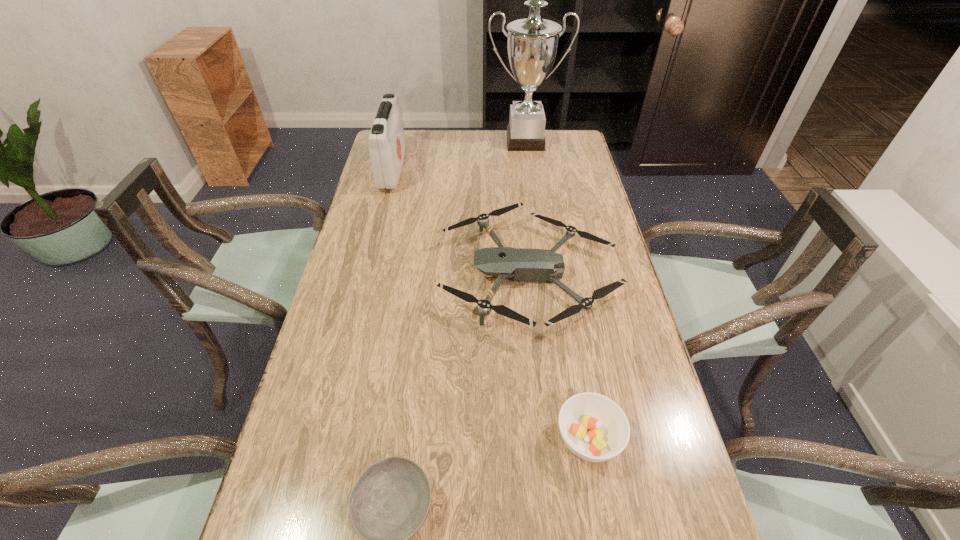
Identify the location of vacant point located 0.190m on the back of the soup bowl. This screenshot has height=540, width=960. (570, 339).

Identify the location of trophy cup that is positioned at the far edge. (532, 45).

The height and width of the screenshot is (540, 960). What are the coordinates of `the first-aid kit present at the far edge` in the screenshot? It's located at point(387,147).

Locate an element on the screen. This screenshot has width=960, height=540. object that is at the left edge is located at coordinates point(387,147).

This screenshot has height=540, width=960. I want to click on trophy cup situated at the right edge, so click(x=532, y=45).

Find the location of a particular element. drone that is at the right edge is located at coordinates (518, 264).

Where is `soup bowl positioned at the right edge`? The width and height of the screenshot is (960, 540). soup bowl positioned at the right edge is located at coordinates (594, 428).

Where is `object that is at the far left corner`? The width and height of the screenshot is (960, 540). object that is at the far left corner is located at coordinates (387, 147).

Image resolution: width=960 pixels, height=540 pixels. Find the location of `object positioned at the far right corner`. object positioned at the far right corner is located at coordinates (532, 45).

This screenshot has height=540, width=960. In the image, there is a desktop. In order to click on vacant space at the far edge in this screenshot , I will do `click(459, 130)`.